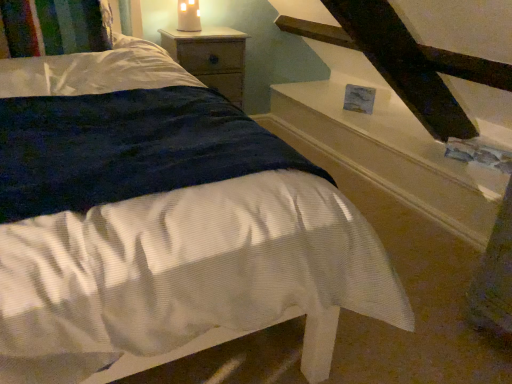
Where is `free point behind matte white candle at upper center`? The width and height of the screenshot is (512, 384). free point behind matte white candle at upper center is located at coordinates (195, 32).